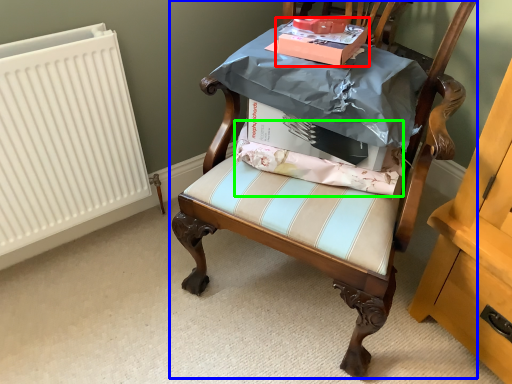
Question: Considering the real-world distances, which object is closest to cardboard box (highlighted by a red box)? chair (highlighted by a blue box) or fabric (highlighted by a green box).

Choices:
 (A) chair
 (B) fabric

Answer: (B)